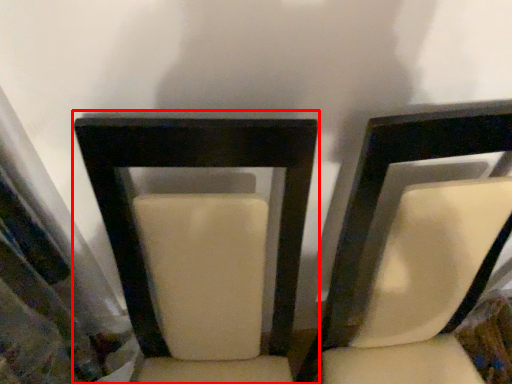
Question: From the image's perspective, considering the relative positions of chair (annotated by the red box) and chair in the image provided, where is chair (annotated by the red box) located with respect to the staircase?

Choices:
 (A) above
 (B) below

Answer: (B)